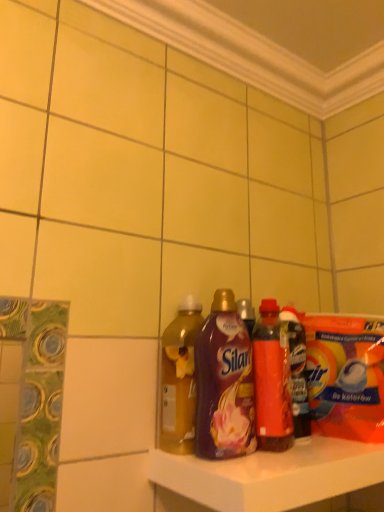
You are a GUI agent. You are given a task and a screenshot of the screen. Output one action in this format:
    pyautogui.click(x=<x>, y=<y>)
    Task: Click on the vacant area that is in front of shiny plastic bottle at center, the 2th bottle when ordered from right to left
    The height and width of the screenshot is (512, 384).
    Given the screenshot: What is the action you would take?
    pyautogui.click(x=277, y=460)